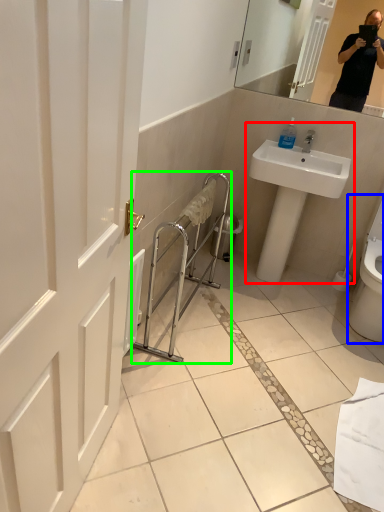
Question: Which is nearer to the sink (highlighted by a red box)? toilet (highlighted by a blue box) or balustrade (highlighted by a green box).

Choices:
 (A) toilet
 (B) balustrade

Answer: (B)